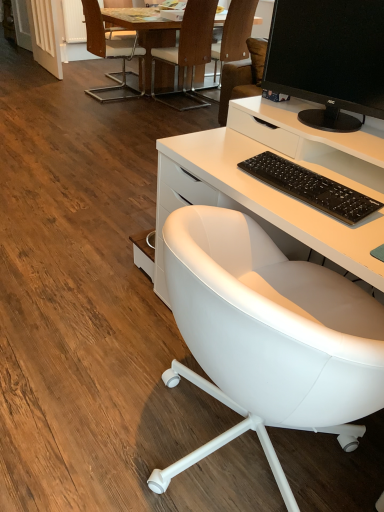
Question: Can you confirm if wooden chair at upper center, which is the 3th chair in back-to-front order, is bigger than brown leather chair at upper center, placed as the 1th chair when sorted from back to front?

Choices:
 (A) yes
 (B) no

Answer: (A)

Question: Is wooden chair at upper center, which appears as the second chair when viewed from the front, smaller than brown leather chair at upper center, the fourth chair viewed from the front?

Choices:
 (A) yes
 (B) no

Answer: (B)

Question: Is wooden chair at upper center, which appears as the second chair when viewed from the front, taller than brown leather chair at upper center, placed as the 1th chair when sorted from back to front?

Choices:
 (A) yes
 (B) no

Answer: (A)

Question: From the image's perspective, is wooden chair at upper center, which appears as the second chair when viewed from the front, beneath brown leather chair at upper center, placed as the 1th chair when sorted from back to front?

Choices:
 (A) no
 (B) yes

Answer: (B)

Question: From a real-world perspective, is wooden chair at upper center, which appears as the second chair when viewed from the front, under brown leather chair at upper center, the fourth chair viewed from the front?

Choices:
 (A) yes
 (B) no

Answer: (B)

Question: Is wooden chair at upper center, which appears as the second chair when viewed from the front, at the left side of brown leather chair at upper center, the fourth chair viewed from the front?

Choices:
 (A) yes
 (B) no

Answer: (A)

Question: Is wooden chair at upper left, the third chair in the front-to-back sequence, smaller than black glossy monitor at upper right?

Choices:
 (A) no
 (B) yes

Answer: (A)

Question: Can you confirm if wooden chair at upper left, the second chair viewed from the back, is positioned to the left of black glossy monitor at upper right?

Choices:
 (A) yes
 (B) no

Answer: (A)

Question: Can you confirm if wooden chair at upper left, the second chair viewed from the back, is thinner than black glossy monitor at upper right?

Choices:
 (A) no
 (B) yes

Answer: (A)

Question: From a real-world perspective, does wooden chair at upper left, the third chair in the front-to-back sequence, sit lower than black glossy monitor at upper right?

Choices:
 (A) no
 (B) yes

Answer: (B)

Question: Is the depth of wooden chair at upper left, the third chair in the front-to-back sequence, greater than that of black glossy monitor at upper right?

Choices:
 (A) yes
 (B) no

Answer: (A)

Question: Are wooden chair at upper left, the third chair in the front-to-back sequence, and black glossy monitor at upper right beside each other?

Choices:
 (A) yes
 (B) no

Answer: (B)

Question: Considering the relative sizes of white leather chair at center, the fourth chair in the back-to-front sequence, and wooden table at upper center in the image provided, is white leather chair at center, the fourth chair in the back-to-front sequence, bigger than wooden table at upper center?

Choices:
 (A) no
 (B) yes

Answer: (A)